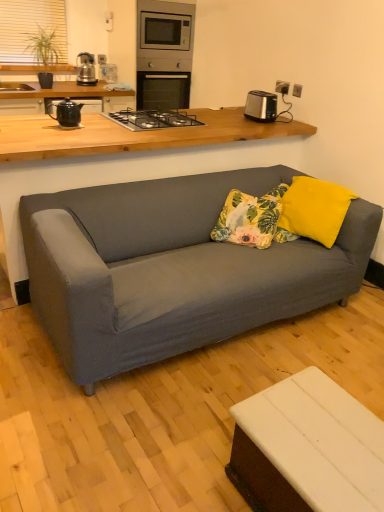
You are a GUI agent. You are given a task and a screenshot of the screen. Output one action in this format:
    pyautogui.click(x=<x>, y=<y>)
    Task: Click on the vacant space that is to the left of black ceramic teapot at left
    This screenshot has width=384, height=512.
    Given the screenshot: What is the action you would take?
    pyautogui.click(x=38, y=121)